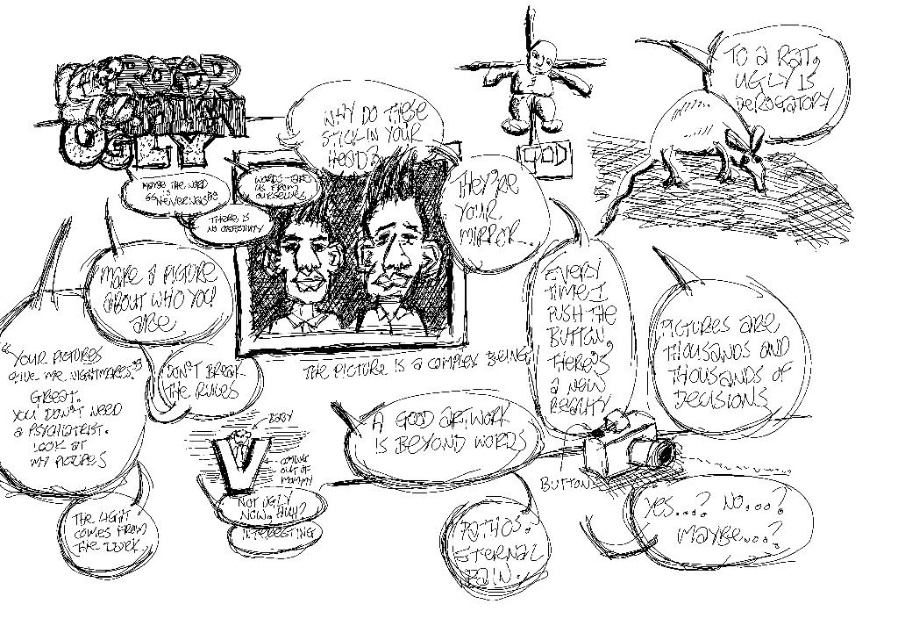
Question: Can you confirm if grayscale sketch portrait at center is wider than smooth black face at center?

Choices:
 (A) yes
 (B) no

Answer: (A)

Question: Which of the following is the closest to the observer?

Choices:
 (A) grayscale sketch portrait at center
 (B) smooth black face at center

Answer: (B)

Question: Observing the image, what is the correct spatial positioning of grayscale sketch portrait at center in reference to smooth black face at center?

Choices:
 (A) left
 (B) right

Answer: (B)

Question: Which object appears closest to the camera in this image?

Choices:
 (A) grayscale sketch portrait at center
 (B) smooth black face at center

Answer: (B)

Question: Considering the relative positions of grayscale sketch portrait at center and smooth black face at center in the image provided, where is grayscale sketch portrait at center located with respect to smooth black face at center?

Choices:
 (A) right
 (B) left

Answer: (A)